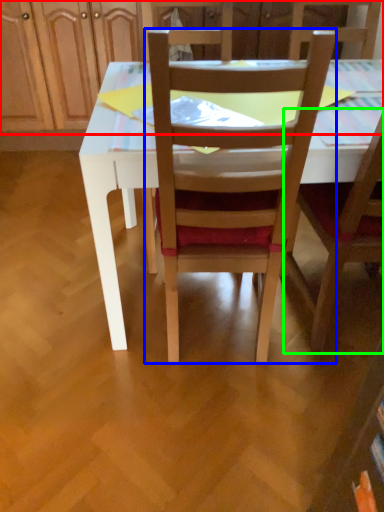
Question: Considering the real-world distances, which object is closest to dresser (highlighted by a red box)? chair (highlighted by a blue box) or chair (highlighted by a green box).

Choices:
 (A) chair
 (B) chair

Answer: (A)